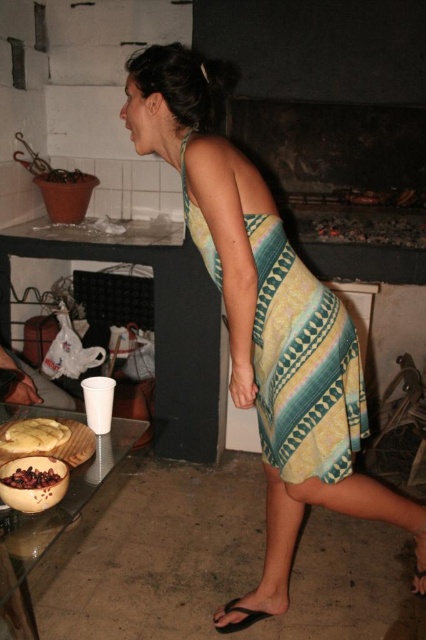
Question: Among these objects, which one is farthest from the camera?

Choices:
 (A) yellow-green striped dress at center
 (B) yellow matte bread at lower left
 (C) dark brown glossy nuts at lower left
 (D) yellow-green printed dress at center

Answer: (D)

Question: Is dark brown glossy nuts at lower left positioned behind black rubber sandal at lower center?

Choices:
 (A) no
 (B) yes

Answer: (A)

Question: Is yellow-green striped dress at center in front of yellow-green printed dress at center?

Choices:
 (A) no
 (B) yes

Answer: (B)

Question: Estimate the real-world distances between objects in this image. Which object is farther from the yellow-green printed dress at center?

Choices:
 (A) dark brown glossy nuts at lower left
 (B) yellow-green striped dress at center

Answer: (A)

Question: Which point is farther from the camera taking this photo?

Choices:
 (A) (34, 484)
 (B) (11, 438)

Answer: (B)

Question: Is yellow-green printed dress at center to the right of yellow matte bread at lower left from the viewer's perspective?

Choices:
 (A) no
 (B) yes

Answer: (B)